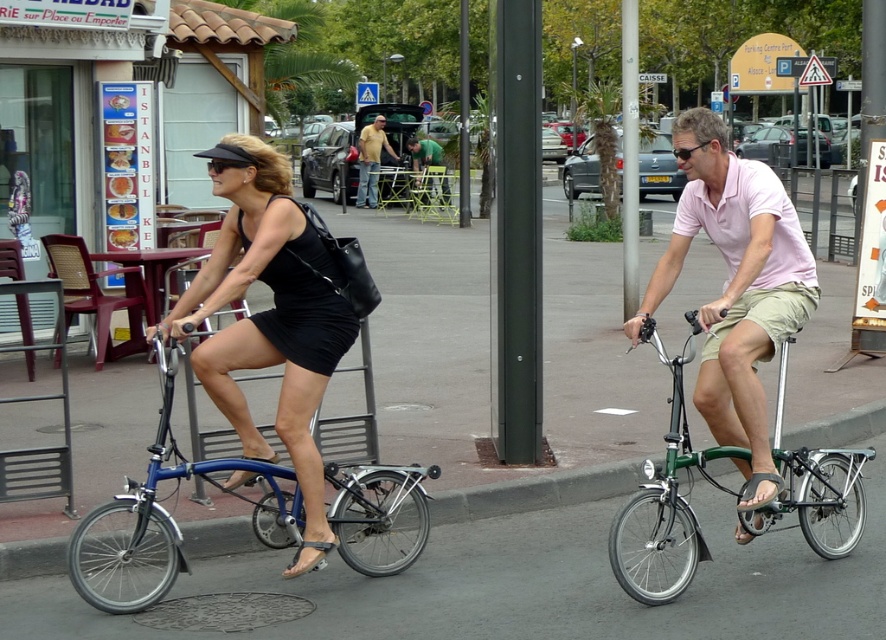
Does point (518, 276) lie behind point (465, 90)?

No, (518, 276) is closer to viewer.

Can you confirm if dark green metallic pole at center is bigger than green metallic pole at center?

Incorrect, dark green metallic pole at center is not larger than green metallic pole at center.

Identify the location of dark green metallic pole at center. This screenshot has width=886, height=640. (517, 232).

Does blue metallic bicycle at left have a larger size compared to green fabric shirt at center?

Indeed, blue metallic bicycle at left has a larger size compared to green fabric shirt at center.

The width and height of the screenshot is (886, 640). What do you see at coordinates (167, 518) in the screenshot?
I see `blue metallic bicycle at left` at bounding box center [167, 518].

Between point (173, 371) and point (437, 186), which one is positioned behind?

Positioned behind is point (437, 186).

This screenshot has width=886, height=640. I want to click on blue metallic bicycle at left, so click(167, 518).

Can you confirm if green metallic bicycle at right is taller than green fabric shirt at center?

Yes.

Who is more forward, (x=776, y=413) or (x=424, y=152)?

Point (x=776, y=413) is more forward.

Where is `green metallic bicycle at right`? The width and height of the screenshot is (886, 640). green metallic bicycle at right is located at coordinates (667, 486).